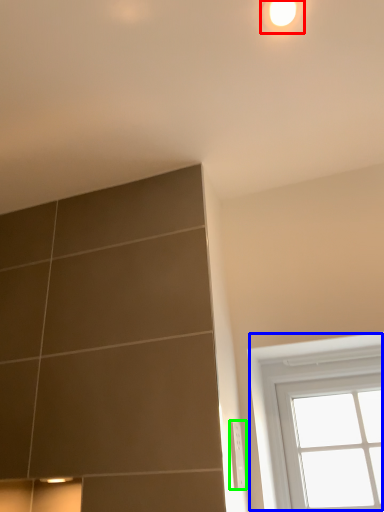
Question: Considering the real-world distances, which object is closest to light (highlighted by a red box)? window (highlighted by a blue box) or electric outlet (highlighted by a green box).

Choices:
 (A) window
 (B) electric outlet

Answer: (B)